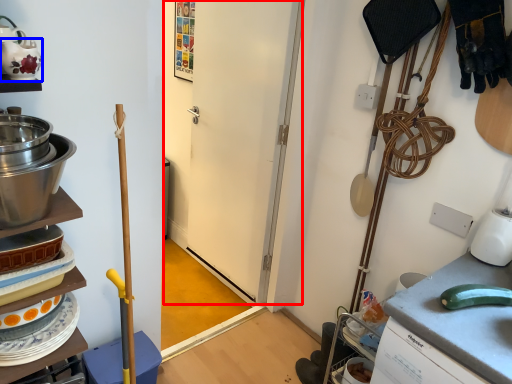
Question: Among these objects, which one is nearest to the camera, door (highlighted by a red box) or tea pot (highlighted by a blue box)?

Choices:
 (A) door
 (B) tea pot

Answer: (B)